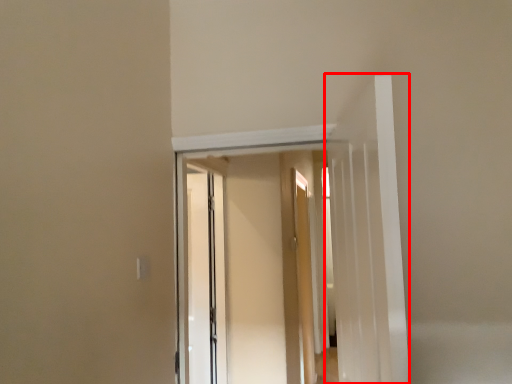
Question: In this image, where is door (annotated by the red box) located relative to screen door?

Choices:
 (A) right
 (B) left

Answer: (A)